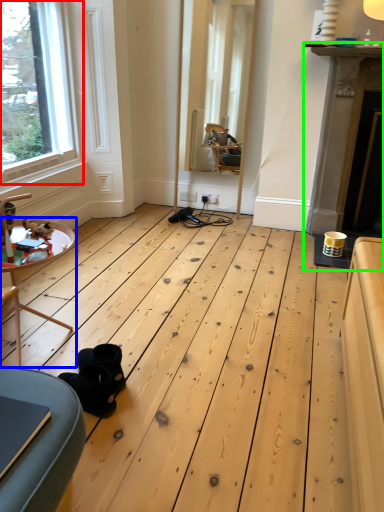
Question: Estimate the real-world distances between objects in this image. Which object is farther from window (highlighted by a red box), table (highlighted by a blue box) or fireplace (highlighted by a green box)?

Choices:
 (A) table
 (B) fireplace

Answer: (B)